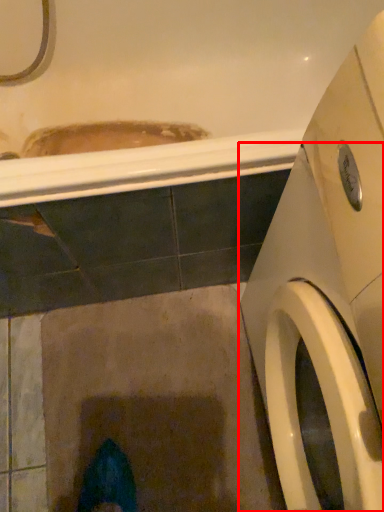
Question: From the image's perspective, what is the correct spatial positioning of washing machine (annotated by the red box) in reference to bath?

Choices:
 (A) above
 (B) below

Answer: (B)